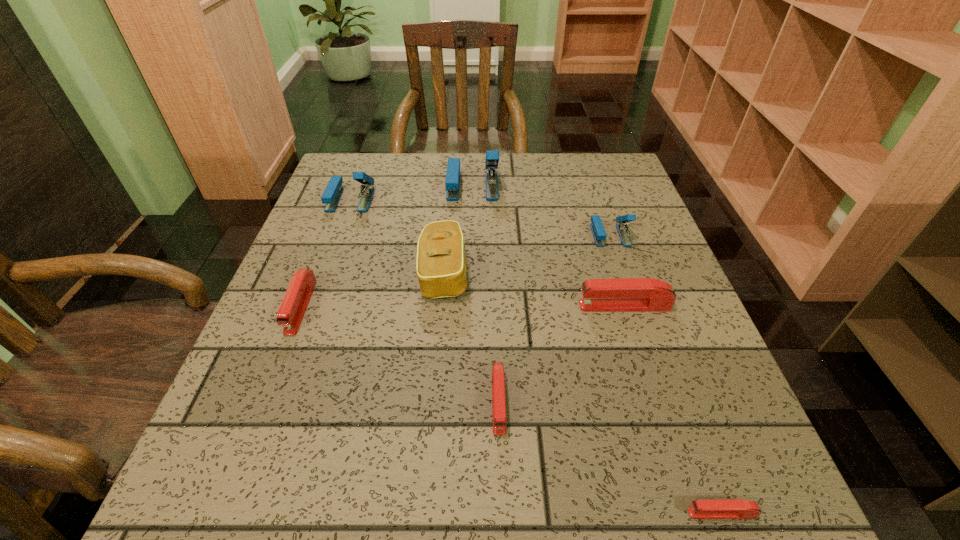
Find the location of a particular element. The image size is (960, 540). red stapler that is the closest to the leftmost blue stapler is located at coordinates (292, 309).

This screenshot has width=960, height=540. I want to click on free space that satisfies the following two spatial constraints: 1. on the front-facing side of the biggest red stapler; 2. on the front-facing side of the third shortest stapler, so click(x=625, y=306).

Image resolution: width=960 pixels, height=540 pixels. What are the coordinates of `free space that satisfies the following two spatial constraints: 1. on the front-facing side of the biggest red stapler; 2. on the front-facing side of the third shortest object` in the screenshot? It's located at (625, 306).

This screenshot has width=960, height=540. I want to click on free space that satisfies the following two spatial constraints: 1. on the front side of the second tallest stapler; 2. on the left side of the third farthest stapler, so click(338, 235).